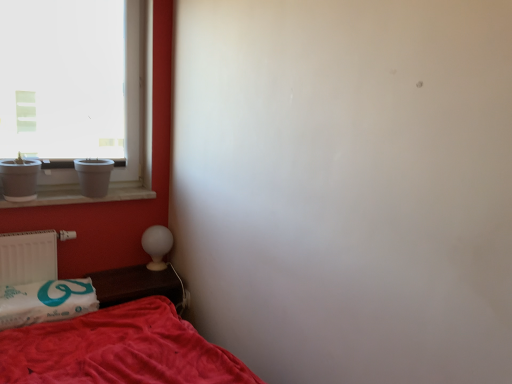
Question: From the image's perspective, is white glossy table lamp at lower left positioned above or below white matte window at upper left?

Choices:
 (A) below
 (B) above

Answer: (A)

Question: From a real-world perspective, is white glossy table lamp at lower left above or below white matte window at upper left?

Choices:
 (A) below
 (B) above

Answer: (A)

Question: Which of these objects is positioned farthest from the white soft pillow at lower left?

Choices:
 (A) white marble window sill at left
 (B) brown wooden table at lower left
 (C) white matte window at upper left
 (D) white glossy table lamp at lower left
 (E) white matte radiator at lower left

Answer: (C)

Question: Which is nearer to the brown wooden table at lower left?

Choices:
 (A) white matte radiator at lower left
 (B) white marble window sill at left
 (C) white soft pillow at lower left
 (D) white glossy table lamp at lower left
 (E) white matte window at upper left

Answer: (D)